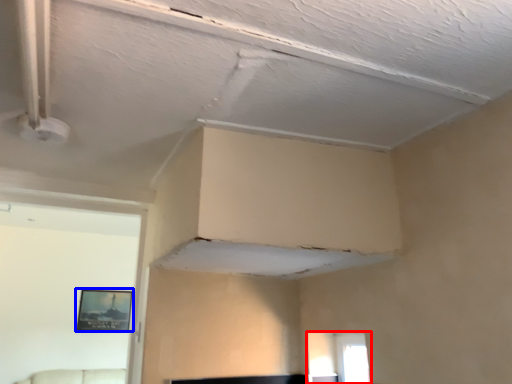
Question: Which point is closer to the camera, window (highlighted by a red box) or picture frame (highlighted by a blue box)?

Choices:
 (A) window
 (B) picture frame

Answer: (A)